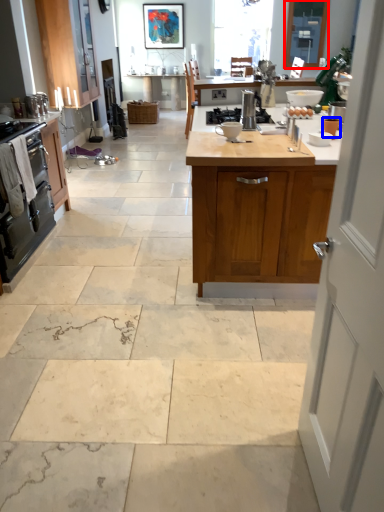
Question: Among these objects, which one is farthest to the camera, window screen (highlighted by a red box) or appliance (highlighted by a blue box)?

Choices:
 (A) window screen
 (B) appliance

Answer: (A)